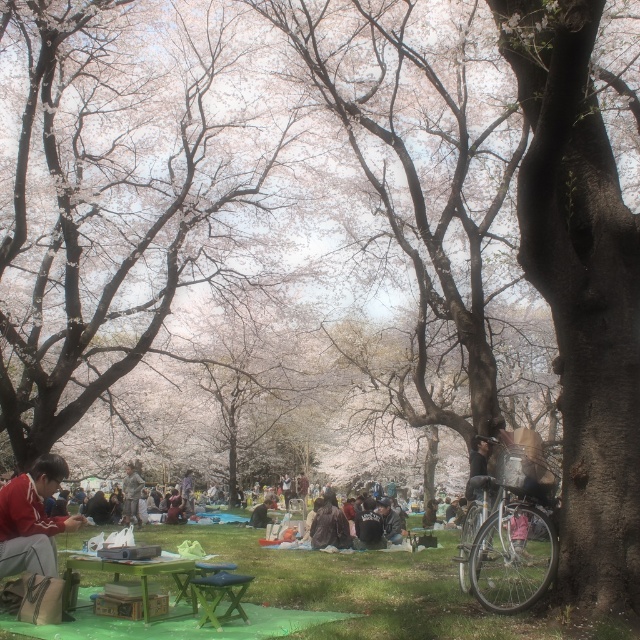
You are a photographer setting up a tripod to capture the scene. The tripod requires at least 1 meter of clearance between the red jacket at lower left and the green wood park bench at center to avoid blocking the view. Based on their heights, can the tripod be placed between them without obstruction?

The red jacket at lower left is taller than the green wood park bench at center, so the tripod might be blocked by the jacket if placed between them. Ensure the tripod is positioned where both objects do not obstruct the view.

You are standing in the park and want to place a small bench between the two points, point (204, 588) and point (134, 516). Which point should the bench be closer to if you want it to be near the tree trunk on the right side?

The bench should be placed closer to point (204, 588) because it is closer to the viewer than point (134, 516). Since the tree trunk is in the foreground on the right, positioning the bench nearer to the closer point would place it nearer to the tree trunk.

You are standing at the center of the park and see the red jacket at lower left. If you want to walk directly towards it, which direction should you head?

The red jacket at lower left is located at point (33, 518), so you should head towards the lower left direction to reach it.